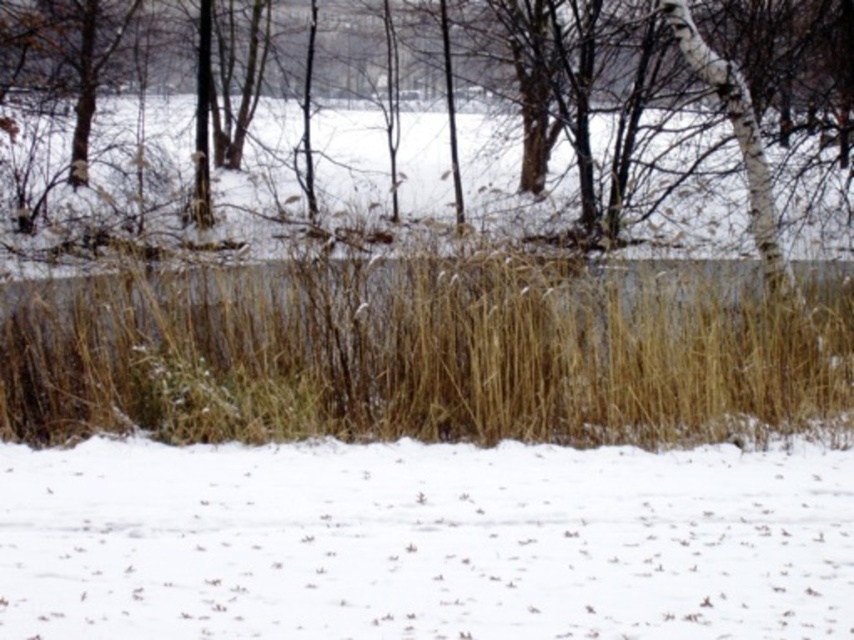
Is white fluffy snow at lower center bigger than brown grass at center?

No.

Is white fluffy snow at lower center taller than brown grass at center?

Incorrect, white fluffy snow at lower center's height is not larger of brown grass at center's.

Between point (209, 624) and point (360, 131), which one is positioned behind?

Positioned behind is point (360, 131).

Identify the location of white fluffy snow at lower center. Image resolution: width=854 pixels, height=640 pixels. (423, 541).